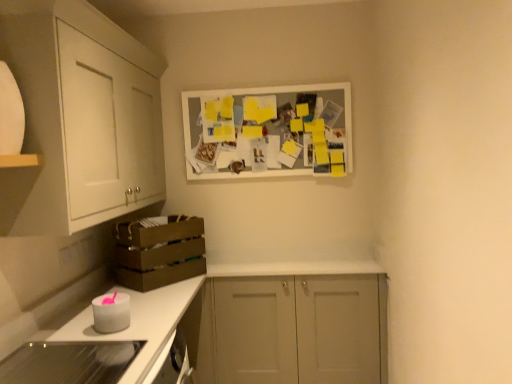
Question: From the image's perspective, is brown cardboard crate at lower left positioned above or below white matte candle at lower left, positioned as the second appliance in bottom-to-top order?

Choices:
 (A) below
 (B) above

Answer: (B)

Question: In terms of height, does brown cardboard crate at lower left look taller or shorter compared to white matte candle at lower left, the 1th appliance in the back-to-front sequence?

Choices:
 (A) short
 (B) tall

Answer: (B)

Question: Which of these objects is positioned farthest from the brown cardboard crate at lower left?

Choices:
 (A) white glossy countertop at lower left
 (B) white matte candle at lower left, arranged as the 1th appliance when viewed from the top
 (C) glassy white stove at lower left, acting as the 1th appliance starting from the front
 (D) white matte cabinet at upper left, the first cabinetry viewed from the top
 (E) white matte cabinet at center, which is counted as the first cabinetry, starting from the right

Answer: (C)

Question: Estimate the real-world distances between objects in this image. Which object is farther from the white matte cabinet at center, which is the 2th cabinetry from left to right?

Choices:
 (A) brown cardboard crate at lower left
 (B) glassy white stove at lower left, acting as the 1th appliance starting from the front
 (C) white glossy countertop at lower left
 (D) white matte picture frame at upper center
 (E) white matte cabinet at upper left, acting as the second cabinetry starting from the right

Answer: (E)